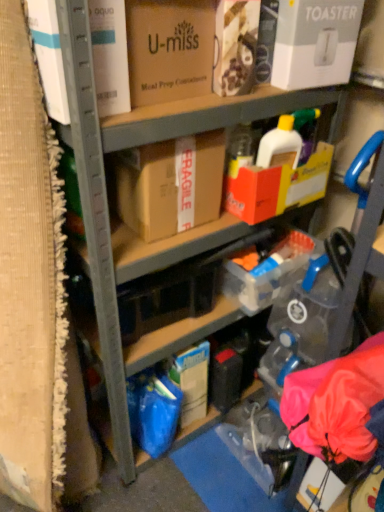
Question: Is matte cardboard box at upper center, marked as the fifth box in a right-to-left arrangement, at the right side of brown cardboard box at center, which is counted as the 2th box, starting from the left?

Choices:
 (A) yes
 (B) no

Answer: (B)

Question: From a real-world perspective, is matte cardboard box at upper center, acting as the 1th box starting from the left, over brown cardboard box at center, which is counted as the 2th box, starting from the left?

Choices:
 (A) no
 (B) yes

Answer: (B)

Question: Considering the relative sizes of matte cardboard box at upper center, acting as the 1th box starting from the left, and brown cardboard box at center, which is counted as the 2th box, starting from the left, in the image provided, is matte cardboard box at upper center, acting as the 1th box starting from the left, taller than brown cardboard box at center, which is counted as the 2th box, starting from the left,?

Choices:
 (A) yes
 (B) no

Answer: (B)

Question: Is matte cardboard box at upper center, marked as the fifth box in a right-to-left arrangement, oriented away from brown cardboard box at center, the fourth box when ordered from right to left?

Choices:
 (A) no
 (B) yes

Answer: (A)

Question: From the image's perspective, is matte cardboard box at upper center, marked as the fifth box in a right-to-left arrangement, located beneath brown cardboard box at center, which is counted as the 2th box, starting from the left?

Choices:
 (A) yes
 (B) no

Answer: (B)

Question: Looking at their shapes, would you say matte cardboard box at upper center, marked as the fifth box in a right-to-left arrangement, is wider or thinner than white cardboard toaster at upper right, marked as the 5th box in a left-to-right arrangement?

Choices:
 (A) wide
 (B) thin

Answer: (A)

Question: From the image's perspective, is matte cardboard box at upper center, acting as the 1th box starting from the left, located above or below white cardboard toaster at upper right, positioned as the first box in right-to-left order?

Choices:
 (A) below
 (B) above

Answer: (A)

Question: In the image, is matte cardboard box at upper center, acting as the 1th box starting from the left, on the left side or the right side of white cardboard toaster at upper right, marked as the 5th box in a left-to-right arrangement?

Choices:
 (A) left
 (B) right

Answer: (A)

Question: Would you say matte cardboard box at upper center, marked as the fifth box in a right-to-left arrangement, is inside or outside white cardboard toaster at upper right, positioned as the first box in right-to-left order?

Choices:
 (A) outside
 (B) inside

Answer: (A)

Question: In terms of height, does brown cardboard box at center, which is counted as the 2th box, starting from the left, look taller or shorter compared to yellow cardboard box at center, the 2th box when ordered from right to left?

Choices:
 (A) tall
 (B) short

Answer: (A)

Question: From the image's perspective, is brown cardboard box at center, which is counted as the 2th box, starting from the left, located above or below yellow cardboard box at center, the 2th box when ordered from right to left?

Choices:
 (A) above
 (B) below

Answer: (B)

Question: Looking at their shapes, would you say brown cardboard box at center, the fourth box when ordered from right to left, is wider or thinner than yellow cardboard box at center, positioned as the fourth box in left-to-right order?

Choices:
 (A) thin
 (B) wide

Answer: (B)

Question: Considering their positions, is brown cardboard box at center, which is counted as the 2th box, starting from the left, located in front of or behind yellow cardboard box at center, the 2th box when ordered from right to left?

Choices:
 (A) front
 (B) behind

Answer: (A)

Question: From the image's perspective, is brown cardboard box at center, which is counted as the 2th box, starting from the left, positioned above or below matte cardboard box at upper center, acting as the 1th box starting from the left?

Choices:
 (A) below
 (B) above

Answer: (A)

Question: In terms of height, does brown cardboard box at center, the fourth box when ordered from right to left, look taller or shorter compared to matte cardboard box at upper center, acting as the 1th box starting from the left?

Choices:
 (A) short
 (B) tall

Answer: (B)